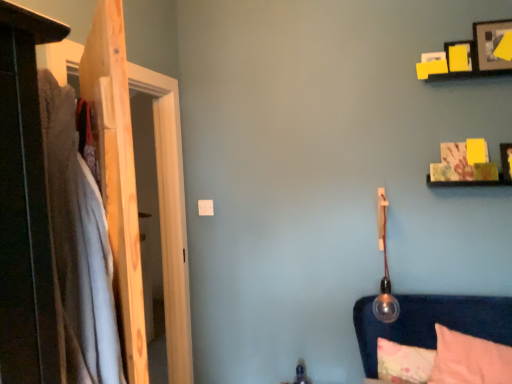
Question: Considering the positions of soft cotton blanket at left and wooden picture frame at upper right, which is the 1th picture frame from bottom to top, in the image, is soft cotton blanket at left taller or shorter than wooden picture frame at upper right, which is the 1th picture frame from bottom to top,?

Choices:
 (A) tall
 (B) short

Answer: (A)

Question: Is soft cotton blanket at left inside the boundaries of wooden picture frame at upper right, the 3th picture frame positioned from the top, or outside?

Choices:
 (A) inside
 (B) outside

Answer: (B)

Question: Based on their relative distances, which object is nearer to the wooden door at left?

Choices:
 (A) pink soft pillow at lower right, which ranks as the 2th pillow in back-to-front order
 (B) wooden picture frame at upper right, the 3th picture frame positioned from the top
 (C) fluffy pink pillow at lower right, which is counted as the first pillow, starting from the back
 (D) wooden picture frame at upper right, the 1th picture frame when ordered from top to bottom
 (E) soft cotton blanket at left

Answer: (E)

Question: Which object is positioned closest to the soft cotton blanket at left?

Choices:
 (A) wooden picture frame at upper right, the third picture frame ordered from the bottom
 (B) wooden door at left
 (C) yellow paper picture frame at upper right, the second picture frame when ordered from bottom to top
 (D) pink soft pillow at lower right, the first pillow in the front-to-back sequence
 (E) wooden picture frame at upper right, which is the 1th picture frame from bottom to top

Answer: (B)